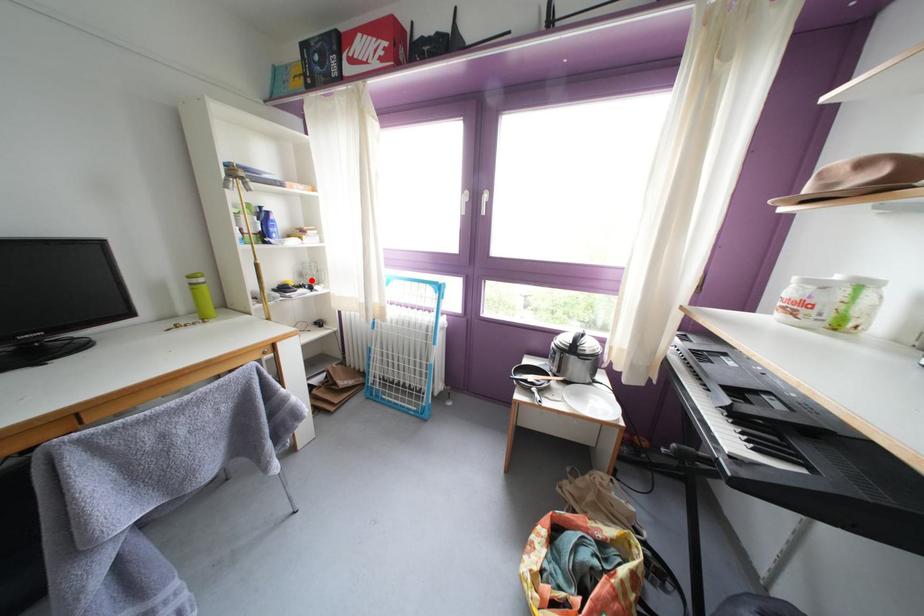
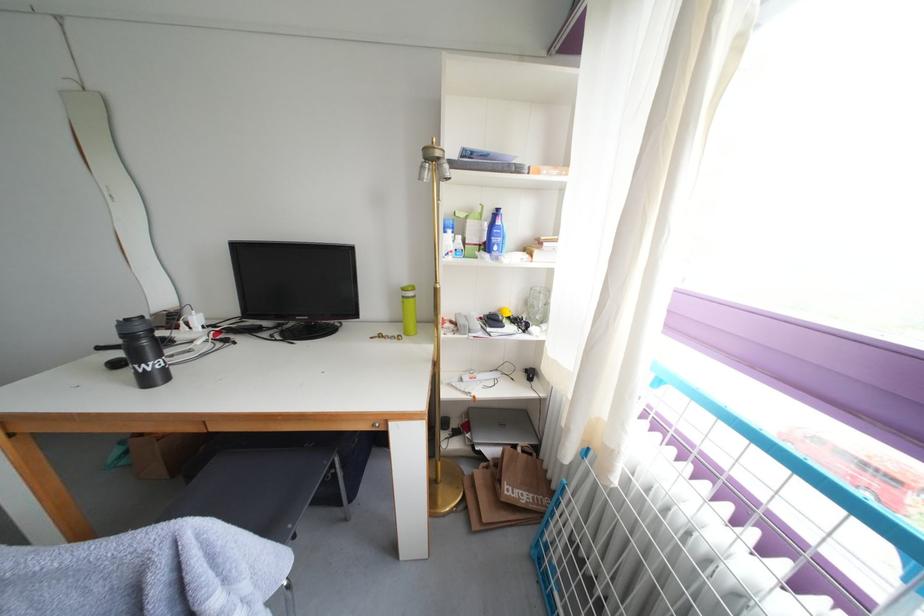
The point at the highlighted location is marked in the first image. Where is the corresponding point in the second image?

(537, 309)